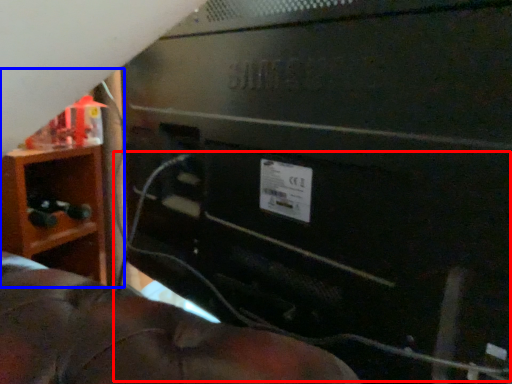
Question: Which of the following is the farthest to the observer, wire (highlighted by a red box) or furniture (highlighted by a blue box)?

Choices:
 (A) wire
 (B) furniture

Answer: (B)